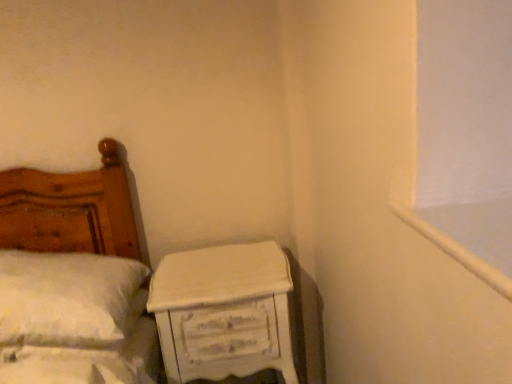
Question: Does white fluffy pillow at left touch white distressed wood nightstand at lower right?

Choices:
 (A) yes
 (B) no

Answer: (B)

Question: Is white fluffy pillow at left at the right side of white distressed wood nightstand at lower right?

Choices:
 (A) no
 (B) yes

Answer: (A)

Question: Is white distressed wood nightstand at lower right surrounded by white fluffy pillow at left?

Choices:
 (A) no
 (B) yes

Answer: (A)

Question: Does white fluffy pillow at left come in front of white distressed wood nightstand at lower right?

Choices:
 (A) no
 (B) yes

Answer: (B)

Question: Can you confirm if white fluffy pillow at left is smaller than white distressed wood nightstand at lower right?

Choices:
 (A) yes
 (B) no

Answer: (A)

Question: From a real-world perspective, is white distressed wood nightstand at lower right above or below white fluffy pillow at left?

Choices:
 (A) above
 (B) below

Answer: (B)

Question: In terms of height, does white distressed wood nightstand at lower right look taller or shorter compared to white fluffy pillow at left?

Choices:
 (A) tall
 (B) short

Answer: (A)

Question: In the image, is white distressed wood nightstand at lower right positioned in front of or behind white fluffy pillow at left?

Choices:
 (A) behind
 (B) front

Answer: (A)

Question: Is point (206, 327) closer or farther from the camera than point (4, 271)?

Choices:
 (A) closer
 (B) farther

Answer: (B)

Question: From the image's perspective, is white distressed wood nightstand at lower right positioned above or below white painted wood at upper right?

Choices:
 (A) below
 (B) above

Answer: (A)

Question: Considering the positions of white distressed wood nightstand at lower right and white painted wood at upper right in the image, is white distressed wood nightstand at lower right taller or shorter than white painted wood at upper right?

Choices:
 (A) tall
 (B) short

Answer: (A)

Question: Looking at the image, does white distressed wood nightstand at lower right seem bigger or smaller compared to white painted wood at upper right?

Choices:
 (A) big
 (B) small

Answer: (A)

Question: Relative to white painted wood at upper right, is white distressed wood nightstand at lower right in front or behind?

Choices:
 (A) behind
 (B) front

Answer: (A)

Question: From a real-world perspective, is white fluffy pillow at left above or below white painted wood at upper right?

Choices:
 (A) above
 (B) below

Answer: (B)

Question: Is white fluffy pillow at left in front of or behind white painted wood at upper right in the image?

Choices:
 (A) front
 (B) behind

Answer: (B)